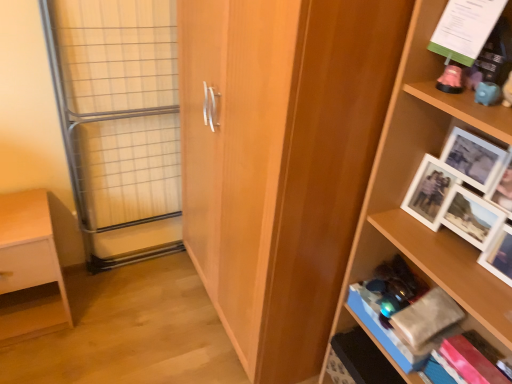
Question: Does white matte wooden shelf at lower left, acting as the first shelf starting from the left, turn towards wooden cupboard at center?

Choices:
 (A) no
 (B) yes

Answer: (A)

Question: Considering the relative sizes of white matte wooden shelf at lower left, acting as the first shelf starting from the left, and wooden cupboard at center in the image provided, is white matte wooden shelf at lower left, acting as the first shelf starting from the left, smaller than wooden cupboard at center?

Choices:
 (A) no
 (B) yes

Answer: (B)

Question: Is white matte wooden shelf at lower left, which is counted as the third shelf, starting from the right, facing away from wooden cupboard at center?

Choices:
 (A) no
 (B) yes

Answer: (A)

Question: Considering the relative positions of white matte wooden shelf at lower left, acting as the first shelf starting from the left, and wooden cupboard at center in the image provided, is white matte wooden shelf at lower left, acting as the first shelf starting from the left, to the right of wooden cupboard at center from the viewer's perspective?

Choices:
 (A) yes
 (B) no

Answer: (B)

Question: Is wooden cupboard at center surrounded by white matte wooden shelf at lower left, acting as the first shelf starting from the left?

Choices:
 (A) no
 (B) yes

Answer: (A)

Question: Is white matte wooden shelf at lower left, which is counted as the third shelf, starting from the right, closer to the viewer compared to wooden cupboard at center?

Choices:
 (A) no
 (B) yes

Answer: (A)

Question: Does white matte wooden shelf at lower left, acting as the first shelf starting from the left, have a lesser width compared to pink plastic piggy bank at upper right, positioned as the second shelf in left-to-right order?

Choices:
 (A) yes
 (B) no

Answer: (B)

Question: Is white matte wooden shelf at lower left, which is counted as the third shelf, starting from the right, wider than pink plastic piggy bank at upper right, which appears as the second shelf when viewed from the right?

Choices:
 (A) no
 (B) yes

Answer: (B)

Question: Can pink plastic piggy bank at upper right, positioned as the second shelf in left-to-right order, be found inside white matte wooden shelf at lower left, acting as the first shelf starting from the left?

Choices:
 (A) yes
 (B) no

Answer: (B)

Question: Could you tell me if white matte wooden shelf at lower left, which is counted as the third shelf, starting from the right, is facing pink plastic piggy bank at upper right, which appears as the second shelf when viewed from the right?

Choices:
 (A) yes
 (B) no

Answer: (B)

Question: Considering the relative positions of white matte wooden shelf at lower left, which is counted as the third shelf, starting from the right, and pink plastic piggy bank at upper right, positioned as the second shelf in left-to-right order, in the image provided, is white matte wooden shelf at lower left, which is counted as the third shelf, starting from the right, to the right of pink plastic piggy bank at upper right, positioned as the second shelf in left-to-right order, from the viewer's perspective?

Choices:
 (A) yes
 (B) no

Answer: (B)

Question: Is white matte wooden shelf at lower left, which is counted as the third shelf, starting from the right, to the left of pink plastic piggy bank at upper right, which appears as the second shelf when viewed from the right, from the viewer's perspective?

Choices:
 (A) no
 (B) yes

Answer: (B)

Question: Does white matte wooden shelf at lower left, which is counted as the third shelf, starting from the right, appear on the right side of clear glass door at left?

Choices:
 (A) yes
 (B) no

Answer: (B)